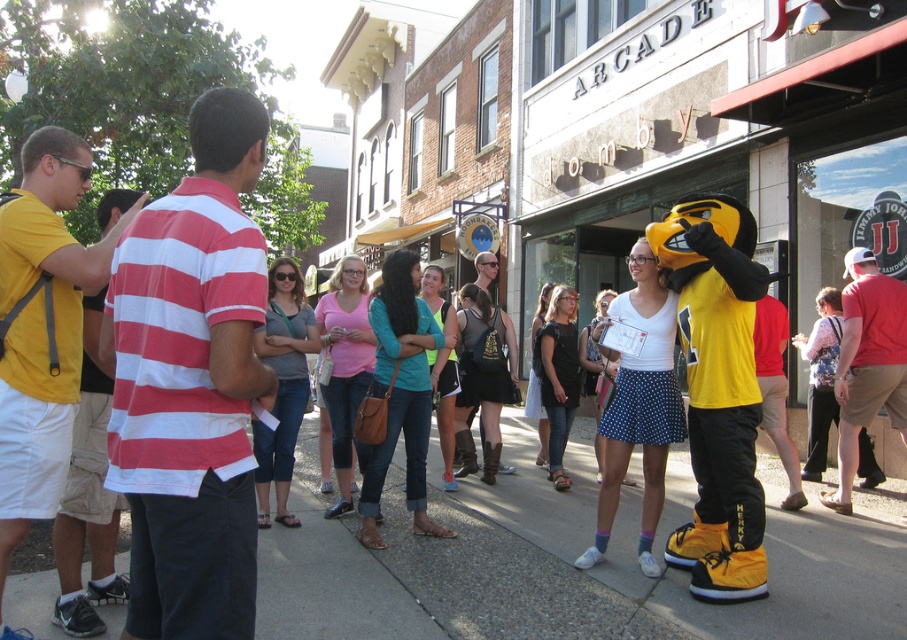
You are a photographer standing in the middle of the sidewalk. You want to take a photo that includes both the red and white striped polo shirt at left and the yellow matte shirt at left. What is the minimum distance you need to move forward or backward to ensure both are in frame?

The red and white striped polo shirt at left and yellow matte shirt at left are 1.08 meters apart. To include both in the frame, you need to adjust your position so that the distance between them fits within your camera lens field of view. Since the exact focal length and sensor size aren